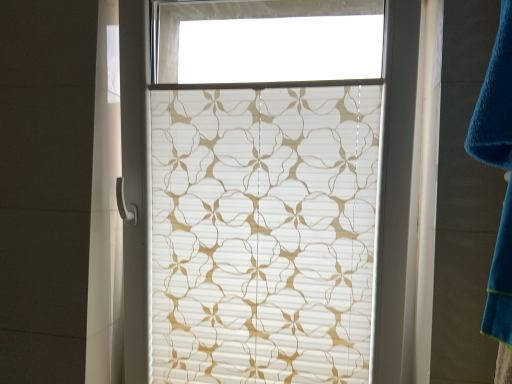
This screenshot has height=384, width=512. I want to click on translucent beige floral-patterned window blind at center, so tap(263, 234).

The width and height of the screenshot is (512, 384). Describe the element at coordinates (263, 234) in the screenshot. I see `translucent beige floral-patterned window blind at center` at that location.

What do you see at coordinates (495, 102) in the screenshot? The image size is (512, 384). I see `blue soft towel at right` at bounding box center [495, 102].

This screenshot has height=384, width=512. Find the location of `blue soft towel at right`. blue soft towel at right is located at coordinates (495, 102).

The image size is (512, 384). I want to click on translucent beige floral-patterned window blind at center, so click(263, 234).

Which is more to the left, blue soft towel at right or translucent beige floral-patterned window blind at center?

translucent beige floral-patterned window blind at center is more to the left.

Which is behind, blue soft towel at right or translucent beige floral-patterned window blind at center?

translucent beige floral-patterned window blind at center is behind.

Considering the points (482, 140) and (158, 365), which point is behind, point (482, 140) or point (158, 365)?

The point (158, 365) is farther from the camera.

From the image's perspective, between blue soft towel at right and translucent beige floral-patterned window blind at center, which one is located above?

From the image's view, blue soft towel at right is above.

From a real-world perspective, is blue soft towel at right under translucent beige floral-patterned window blind at center?

No.

Which object is wider, blue soft towel at right or translucent beige floral-patterned window blind at center?

With larger width is translucent beige floral-patterned window blind at center.

Can you confirm if blue soft towel at right is taller than translucent beige floral-patterned window blind at center?

In fact, blue soft towel at right may be shorter than translucent beige floral-patterned window blind at center.

Looking at the image, does blue soft towel at right seem bigger or smaller compared to translucent beige floral-patterned window blind at center?

In the image, blue soft towel at right appears to be smaller than translucent beige floral-patterned window blind at center.

Which is correct: blue soft towel at right is inside translucent beige floral-patterned window blind at center, or outside of it?

blue soft towel at right is not inside translucent beige floral-patterned window blind at center, it's outside.

Is blue soft towel at right beside translucent beige floral-patterned window blind at center?

No, blue soft towel at right is not in contact with translucent beige floral-patterned window blind at center.

Consider the image. Is blue soft towel at right aimed at translucent beige floral-patterned window blind at center?

No, blue soft towel at right does not turn towards translucent beige floral-patterned window blind at center.

Can you tell me how much blue soft towel at right and translucent beige floral-patterned window blind at center differ in facing direction?

The angle between the facing direction of blue soft towel at right and the facing direction of translucent beige floral-patterned window blind at center is 91.2 degrees.

How far apart are blue soft towel at right and translucent beige floral-patterned window blind at center?

blue soft towel at right and translucent beige floral-patterned window blind at center are 23.21 inches apart from each other.

In the image, there is a blue soft towel at right. At what (x,y) coordinates should I click in order to perform the action: click on window blind below it (from the image's perspective). Please return your answer as a coordinate pair (x, y). Looking at the image, I should click on (263, 234).

Is translucent beige floral-patterned window blind at center to the left of blue soft towel at right from the viewer's perspective?

Indeed, translucent beige floral-patterned window blind at center is positioned on the left side of blue soft towel at right.

Is translucent beige floral-patterned window blind at center positioned before blue soft towel at right?

No.

Does point (216, 367) come in front of point (510, 152)?

No, (216, 367) is behind (510, 152).

From the image's perspective, does translucent beige floral-patterned window blind at center appear lower than blue soft towel at right?

Yes.

From a real-world perspective, is translucent beige floral-patterned window blind at center located beneath blue soft towel at right?

Indeed, from a real-world perspective, translucent beige floral-patterned window blind at center is positioned beneath blue soft towel at right.

Between translucent beige floral-patterned window blind at center and blue soft towel at right, which one has smaller width?

blue soft towel at right.

Considering the sizes of objects translucent beige floral-patterned window blind at center and blue soft towel at right in the image provided, who is taller, translucent beige floral-patterned window blind at center or blue soft towel at right?

With more height is translucent beige floral-patterned window blind at center.

Based on the photo, between translucent beige floral-patterned window blind at center and blue soft towel at right, which one has larger size?

Bigger between the two is translucent beige floral-patterned window blind at center.

Choose the correct answer: Is translucent beige floral-patterned window blind at center inside blue soft towel at right or outside it?

translucent beige floral-patterned window blind at center is located beyond the bounds of blue soft towel at right.

Is translucent beige floral-patterned window blind at center next to blue soft towel at right and touching it?

There is a gap between translucent beige floral-patterned window blind at center and blue soft towel at right.

Is blue soft towel at right at the back of translucent beige floral-patterned window blind at center?

No, translucent beige floral-patterned window blind at center is not facing the opposite direction of blue soft towel at right.

Can you tell me how much translucent beige floral-patterned window blind at center and blue soft towel at right differ in facing direction?

The facing directions of translucent beige floral-patterned window blind at center and blue soft towel at right are 91.2 degrees apart.

Where is `window blind that appears below the blue soft towel at right (from the image's perspective)`? This screenshot has height=384, width=512. window blind that appears below the blue soft towel at right (from the image's perspective) is located at coordinates (263, 234).

The height and width of the screenshot is (384, 512). I want to click on bath towel in front of the translucent beige floral-patterned window blind at center, so click(495, 102).

Where is `window blind that appears below the blue soft towel at right (from the image's perspective)`? window blind that appears below the blue soft towel at right (from the image's perspective) is located at coordinates (263, 234).